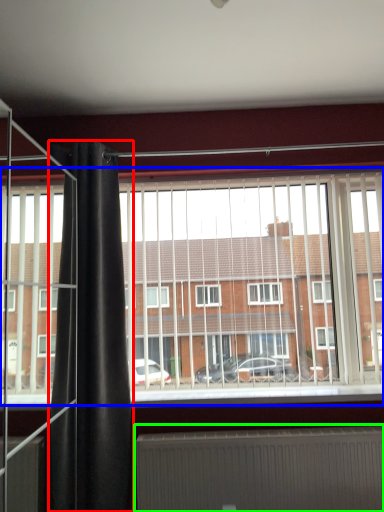
Question: Considering the real-world distances, which object is closest to shower curtain (highlighted by a red box)? window (highlighted by a blue box) or radiator (highlighted by a green box).

Choices:
 (A) window
 (B) radiator

Answer: (A)